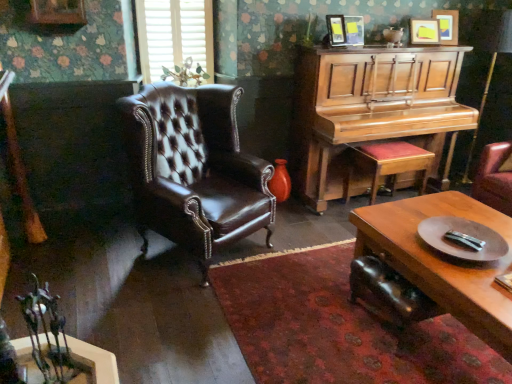
Question: Considering the relative sizes of brown leather chair at left and matte wooden picture frame at upper right, which is the 1th picture frame from right to left, in the image provided, is brown leather chair at left shorter than matte wooden picture frame at upper right, which is the 1th picture frame from right to left,?

Choices:
 (A) yes
 (B) no

Answer: (B)

Question: Is matte wooden picture frame at upper right, which is the 1th picture frame from right to left, surrounded by brown leather chair at left?

Choices:
 (A) no
 (B) yes

Answer: (A)

Question: Considering the relative sizes of brown leather chair at left and matte wooden picture frame at upper right, which is the 1th picture frame from right to left, in the image provided, is brown leather chair at left taller than matte wooden picture frame at upper right, which is the 1th picture frame from right to left,?

Choices:
 (A) no
 (B) yes

Answer: (B)

Question: Does brown leather chair at left turn towards matte wooden picture frame at upper right, the fourth picture frame positioned from the left?

Choices:
 (A) no
 (B) yes

Answer: (A)

Question: Is brown leather chair at left at the left side of matte wooden picture frame at upper right, which is the 1th picture frame from right to left?

Choices:
 (A) yes
 (B) no

Answer: (A)

Question: From a real-world perspective, is brown leather chair at left located higher than matte wooden picture frame at upper right, which is the 1th picture frame from right to left?

Choices:
 (A) yes
 (B) no

Answer: (B)

Question: Can you confirm if white matte blinds at upper left is positioned to the right of wooden piano at right?

Choices:
 (A) no
 (B) yes

Answer: (A)

Question: Does white matte blinds at upper left come behind wooden piano at right?

Choices:
 (A) yes
 (B) no

Answer: (A)

Question: Is wooden piano at right a part of white matte blinds at upper left?

Choices:
 (A) no
 (B) yes

Answer: (A)

Question: Can you confirm if white matte blinds at upper left is shorter than wooden piano at right?

Choices:
 (A) no
 (B) yes

Answer: (B)

Question: Is white matte blinds at upper left next to wooden piano at right?

Choices:
 (A) yes
 (B) no

Answer: (B)

Question: Considering the relative sizes of white matte blinds at upper left and wooden piano at right in the image provided, is white matte blinds at upper left bigger than wooden piano at right?

Choices:
 (A) yes
 (B) no

Answer: (B)

Question: Considering the relative sizes of wooden stool with red cushion at right and wooden piano at right in the image provided, is wooden stool with red cushion at right bigger than wooden piano at right?

Choices:
 (A) yes
 (B) no

Answer: (B)